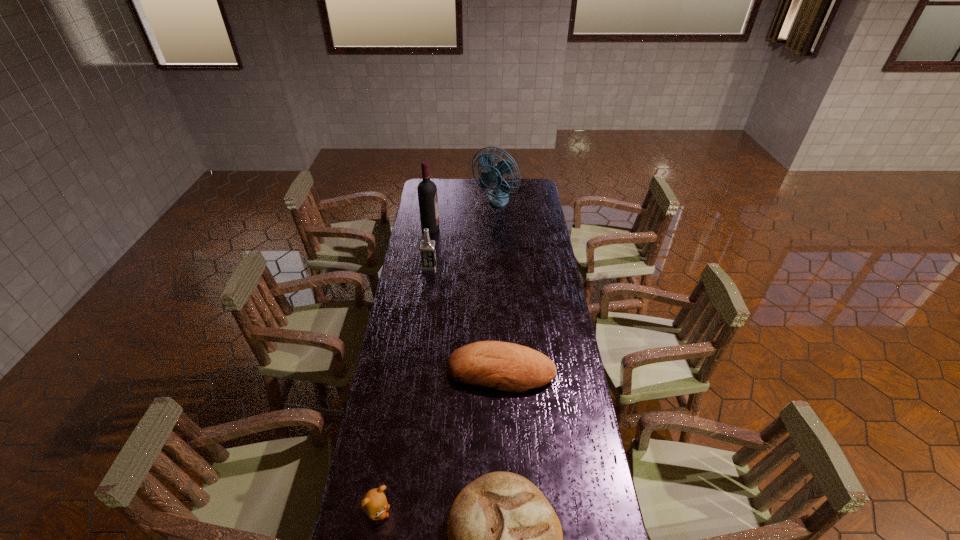
Find the location of a particular element. Image resolution: width=960 pixels, height=540 pixels. free spot that satisfies the following two spatial constraints: 1. on the front label of the third tallest object; 2. on the right side of the third nearest object is located at coordinates (415, 372).

What are the coordinates of `vacant point that satisfies the following two spatial constraints: 1. on the front label of the taller bread; 2. on the right side of the third tallest object` in the screenshot? It's located at (415, 372).

Locate an element on the screen. free space that satisfies the following two spatial constraints: 1. on the back side of the taller bread; 2. on the front label of the vodka is located at coordinates (495, 266).

Where is `free space that satisfies the following two spatial constraints: 1. on the front label of the vodka; 2. on the right side of the farther bread`? Image resolution: width=960 pixels, height=540 pixels. free space that satisfies the following two spatial constraints: 1. on the front label of the vodka; 2. on the right side of the farther bread is located at coordinates (415, 372).

Locate an element on the screen. free point that satisfies the following two spatial constraints: 1. in front of the farthest object to blow air; 2. on the face of the teddy bear is located at coordinates coord(510,513).

What are the coordinates of `vacant space that satisfies the following two spatial constraints: 1. on the label of the farther bread; 2. on the left side of the wine bottle` in the screenshot? It's located at (410, 372).

Find the location of a particular element. The height and width of the screenshot is (540, 960). vacant space that satisfies the following two spatial constraints: 1. in front of the farthest object to blow air; 2. on the face of the teddy bear is located at coordinates (510, 513).